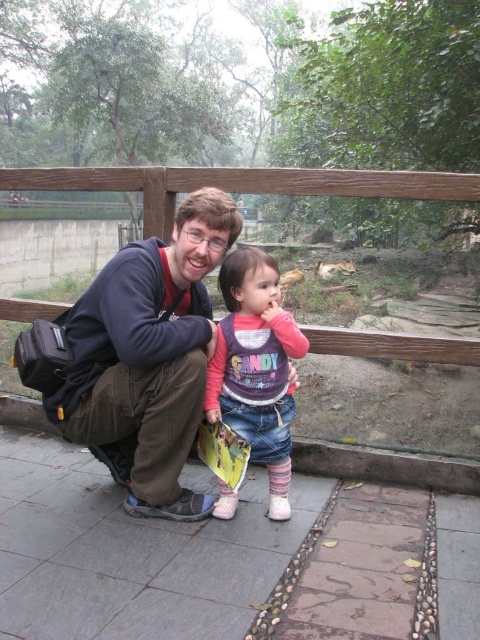
Does matte blue jacket at center have a greater width compared to matte purple sweater at center?

Yes, matte blue jacket at center is wider than matte purple sweater at center.

Between matte blue jacket at center and matte purple sweater at center, which one has less height?

With less height is matte purple sweater at center.

Is point (113, 397) behind point (247, 328)?

No, it is not.

Locate an element on the screen. matte blue jacket at center is located at coordinates (147, 356).